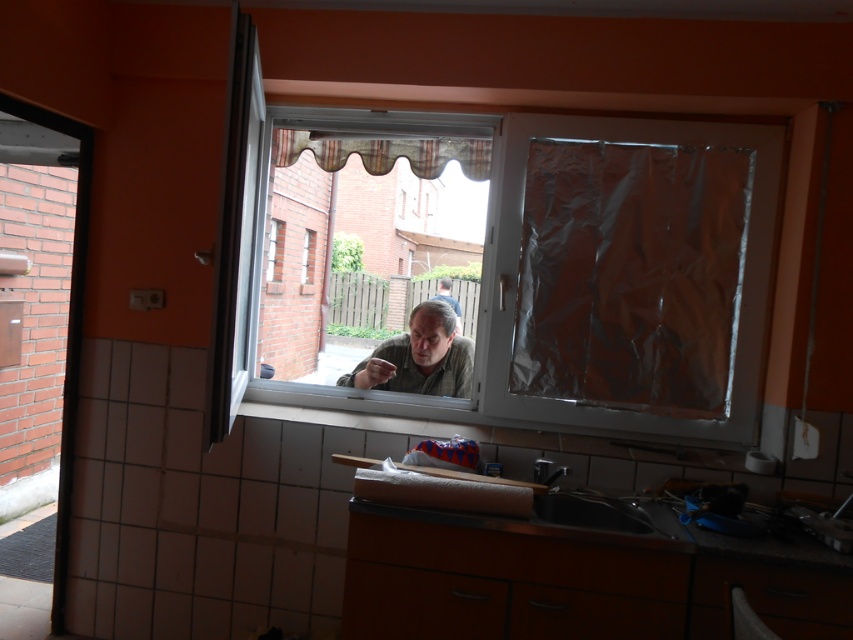
You are standing in the kitchen and want to look outside through the transparent plastic window at center. To do this, should you move to the right or left of the black matte sink at lower center?

To look outside through the transparent plastic window at center, you should move to the left of the black matte sink at lower center because the transparent plastic window at center is located to the left of it.

You are a delivery person trying to place a package on the transparent plastic window at center and the matte brown hair at center. Which surface is wider so the package can fit better?

The transparent plastic window at center is wider than the matte brown hair at center, so the package will fit better on the transparent plastic window at center.

You are a home inspector assessing the kitchen. You need to determine if the black matte sink at lower center can accommodate the matte brown hair at center. Can it fit?

The black matte sink at lower center is bigger than the matte brown hair at center, so yes, the matte brown hair at center can fit inside the black matte sink at lower center.